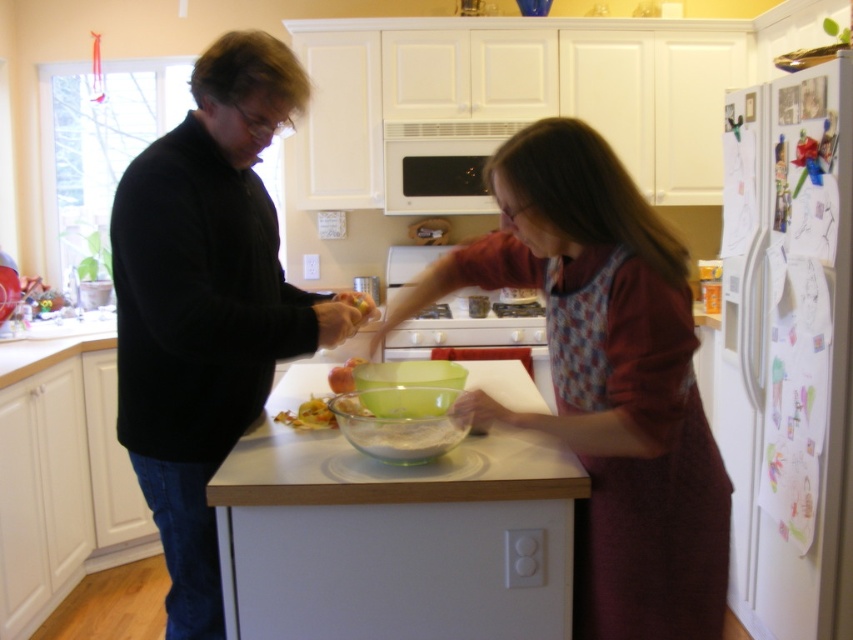
You are organizing the kitchen and need to place the clear glass bowl at center and the white matte microwave at center on the same shelf. Given that the shelf can only hold items up to the size of the microwave, will both items fit?

The clear glass bowl at center is larger in size than the white matte microwave at center, so it won not fit on the shelf since the shelf can only hold items up to the size of the microwave.

You are organizing a kitchen cleanup and need to place the black matte sweater at left and the yellowish matte shredded food at center into their appropriate containers. Which container should each item go into, and why?

The black matte sweater at left should be placed in a laundry basket because it is a larger item meant for washing. The yellowish matte shredded food at center should go into the trash or compost bin since it is food waste and smaller in size.